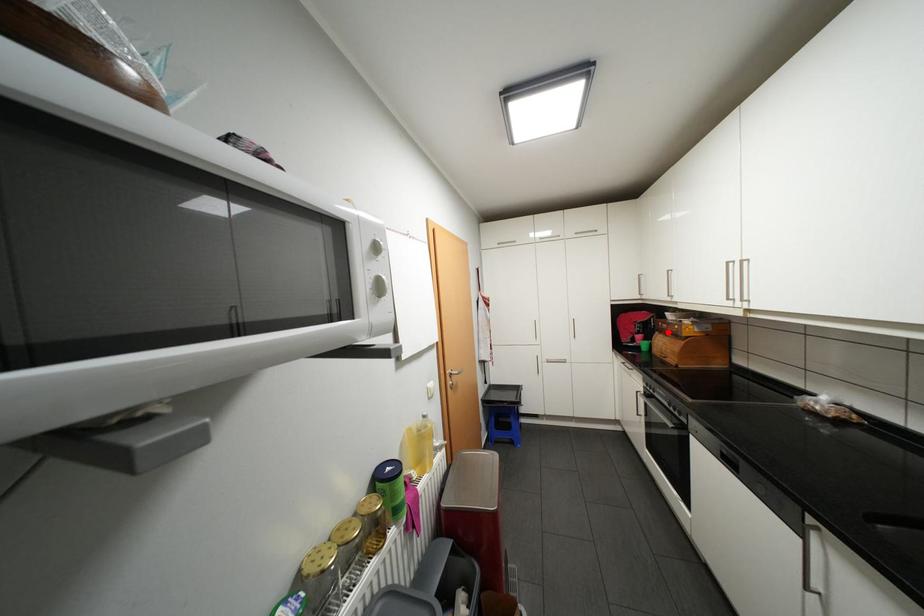
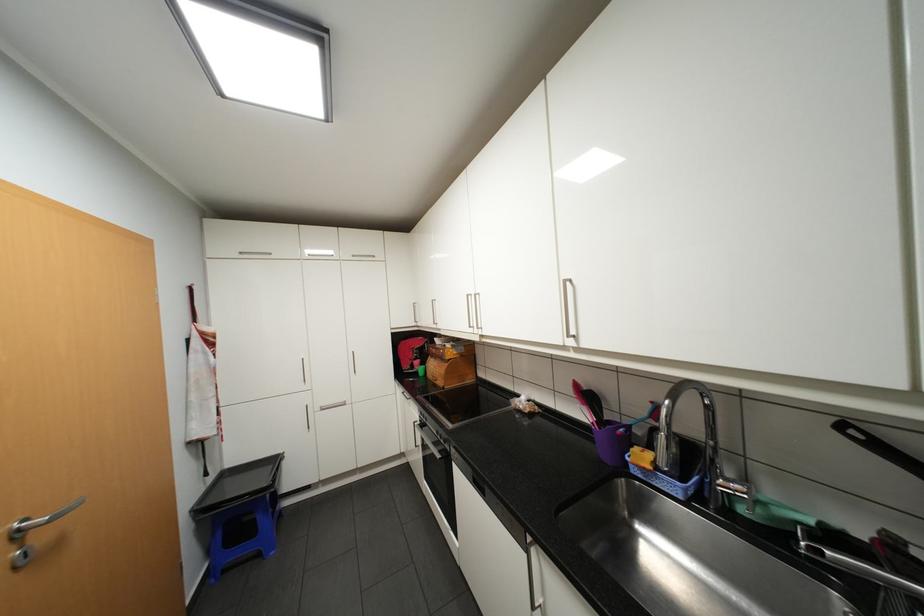
Question: A red point is marked in image1. In image2, is the corresponding 3D point closer to the camera or farther? Reply with the corresponding letter.

Choices:
 (A) The corresponding 3D point is closer.
 (B) The corresponding 3D point is farther.

Answer: (B)